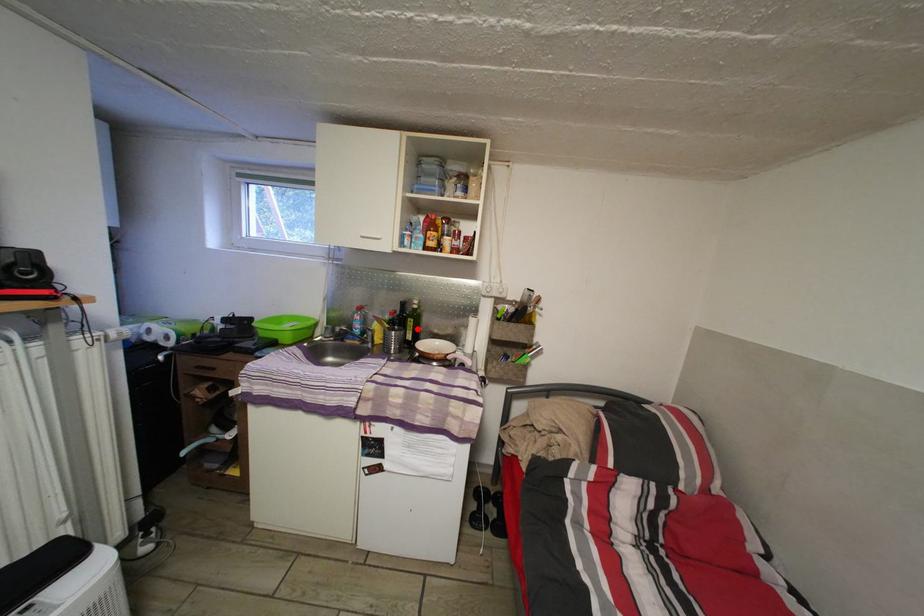
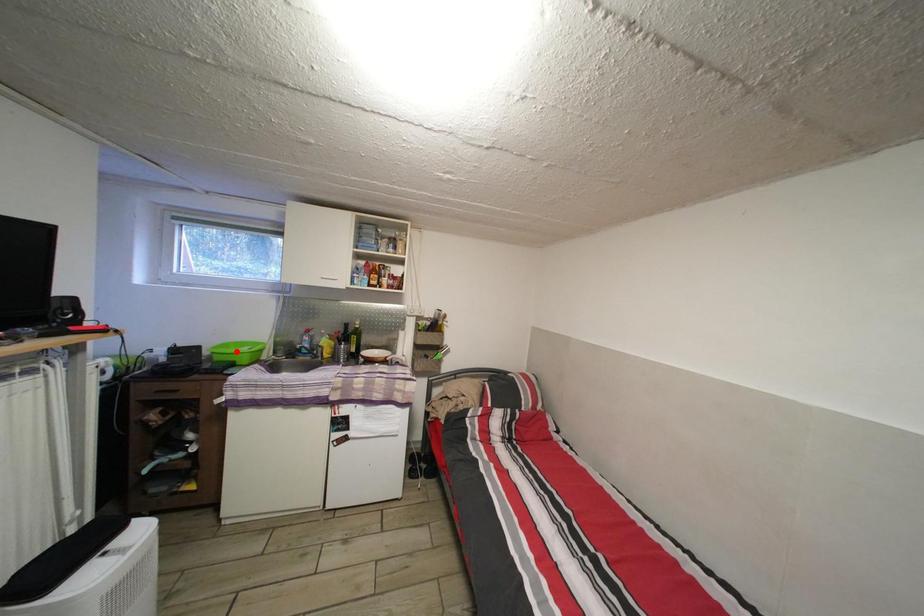
From the picture: I am providing you with two images of the same scene from different viewpoints. A red point is marked on the first image and another point is marked on the second image. Is the marked point in image1 the same physical position as the marked point in image2?

No